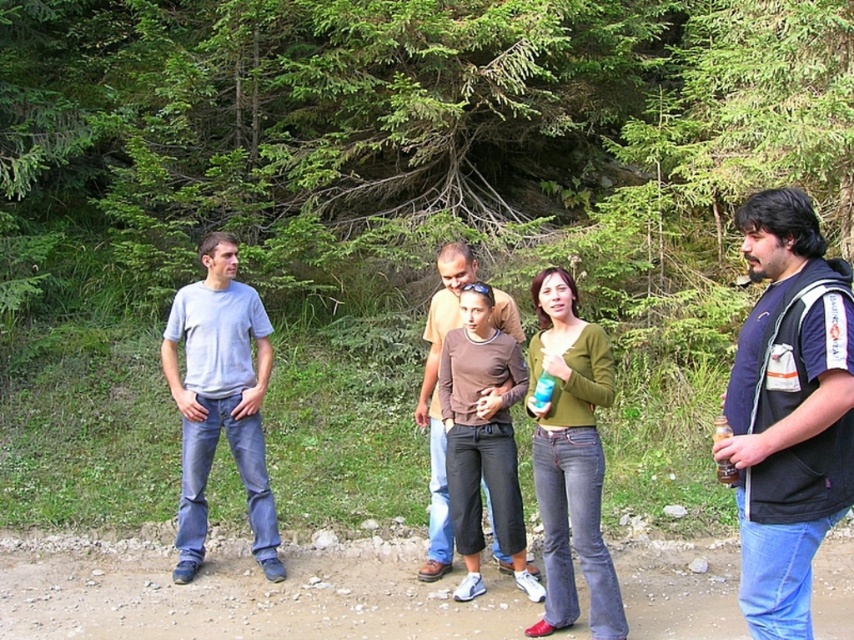
Is light gray t-shirt at left below green matte sweater at center?

Incorrect, light gray t-shirt at left is not positioned below green matte sweater at center.

Does point (185, 528) lie behind point (554, 404)?

That is True.

I want to click on light gray t-shirt at left, so click(x=220, y=400).

Is point (834, 273) farther from camera compared to point (578, 384)?

No, (834, 273) is in front of (578, 384).

Between point (763, 323) and point (568, 328), which one is positioned behind?

Point (568, 328)

At what (x,y) coordinates should I click in order to perform the action: click on dark blue fleece jacket at right. Please return your answer as a coordinate pair (x, y). The width and height of the screenshot is (854, 640). Looking at the image, I should click on (788, 410).

Is point (232, 378) farther from camera compared to point (714, 422)?

No, it is not.

Describe the element at coordinates (220, 400) in the screenshot. The image size is (854, 640). I see `light gray t-shirt at left` at that location.

Image resolution: width=854 pixels, height=640 pixels. What are the coordinates of `light gray t-shirt at left` in the screenshot? It's located at (220, 400).